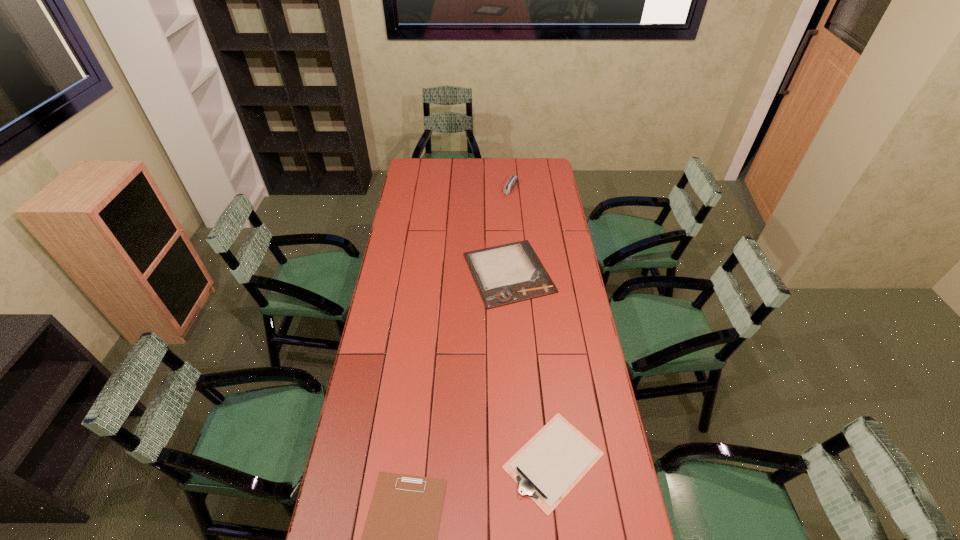
The width and height of the screenshot is (960, 540). I want to click on vacant space at the right edge, so pyautogui.click(x=557, y=230).

Locate an element on the screen. Image resolution: width=960 pixels, height=540 pixels. vacant space at the far right corner of the desktop is located at coordinates (550, 174).

This screenshot has width=960, height=540. Identify the location of vacant space that's between the tallest object and the second tallest clipboard. (532, 325).

Find the location of a particular element. The width and height of the screenshot is (960, 540). blank region between the third nearest object and the farthest object is located at coordinates (510, 231).

Find the location of a particular element. Image resolution: width=960 pixels, height=540 pixels. unoccupied area between the tallest clipboard and the second tallest clipboard is located at coordinates (531, 367).

This screenshot has height=540, width=960. In order to click on the second closest object relative to the shortest clipboard in this screenshot , I will do `click(509, 273)`.

This screenshot has height=540, width=960. In order to click on object identified as the second closest to the tallest clipboard in this screenshot , I will do `click(553, 461)`.

Locate an element on the screen. Image resolution: width=960 pixels, height=540 pixels. clipboard that is the closest to the leftmost object is located at coordinates (553, 461).

This screenshot has width=960, height=540. I want to click on clipboard that is the second closest one to the farthest clipboard, so click(399, 539).

Image resolution: width=960 pixels, height=540 pixels. I want to click on vacant space that satisfies the following two spatial constraints: 1. on the back side of the second tallest object; 2. on the right side of the tallest object, so click(503, 189).